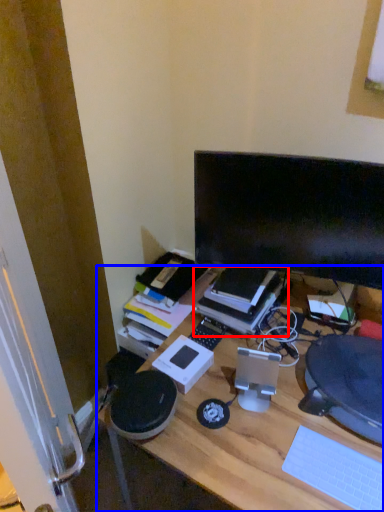
Question: Which point is further to the camera, book (highlighted by a red box) or desk (highlighted by a blue box)?

Choices:
 (A) book
 (B) desk

Answer: (A)